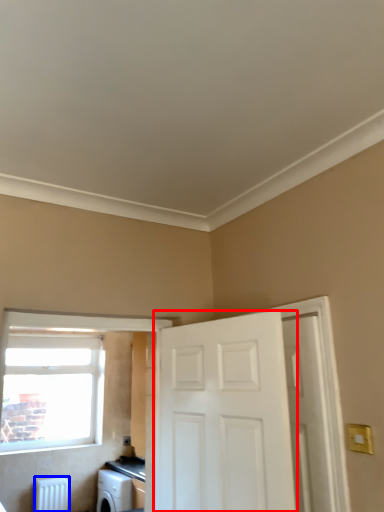
Question: Among these objects, which one is farthest to the camera, door (highlighted by a red box) or radiator (highlighted by a blue box)?

Choices:
 (A) door
 (B) radiator

Answer: (B)